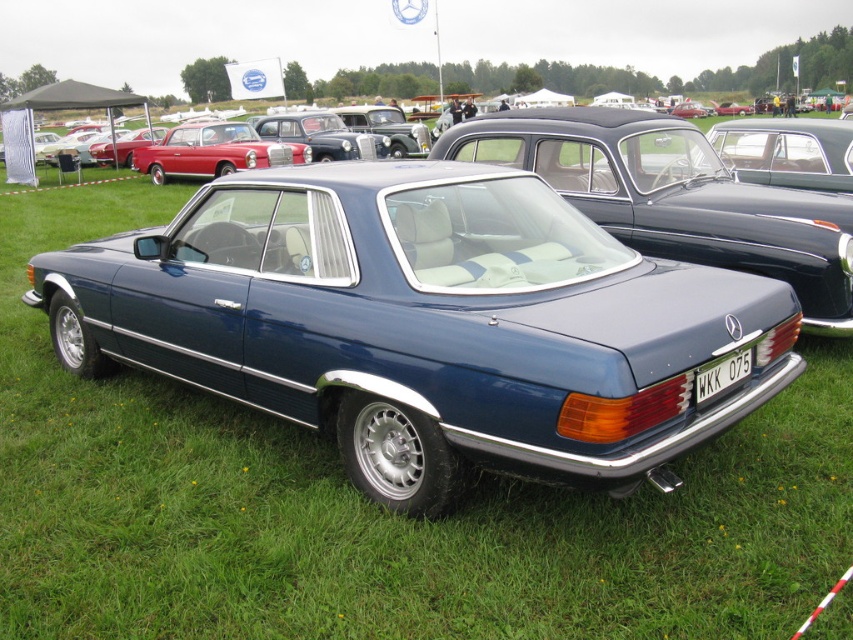
Question: Is satin blue car at center wider than shiny red car at upper left?

Choices:
 (A) yes
 (B) no

Answer: (A)

Question: Which of the following is the closest to the observer?

Choices:
 (A) white plastic license plate at center
 (B) shiny red car at upper left

Answer: (A)

Question: Estimate the real-world distances between objects in this image. Which object is farther from the white plastic license plate at center?

Choices:
 (A) satin blue car at center
 (B) shiny red car at upper left

Answer: (B)

Question: Which object is closer to the camera taking this photo?

Choices:
 (A) shiny red car at upper left
 (B) white plastic license plate at center
 (C) satin blue car at center

Answer: (B)

Question: Is satin blue car at center positioned in front of white plastic license plate at center?

Choices:
 (A) yes
 (B) no

Answer: (B)

Question: Considering the relative positions of satin blue car at center and shiny red car at upper left in the image provided, where is satin blue car at center located with respect to shiny red car at upper left?

Choices:
 (A) right
 (B) left

Answer: (A)